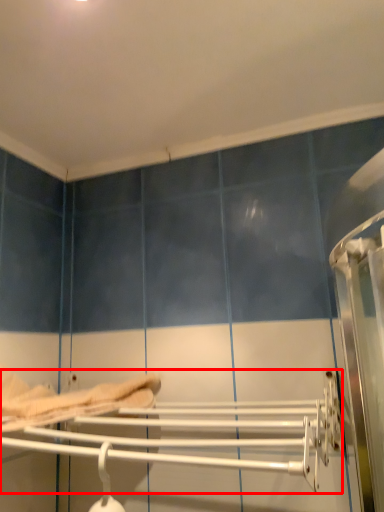
Question: From the image's perspective, what is the correct spatial relationship of towel rack (annotated by the red box) in relation to bed?

Choices:
 (A) below
 (B) above

Answer: (A)